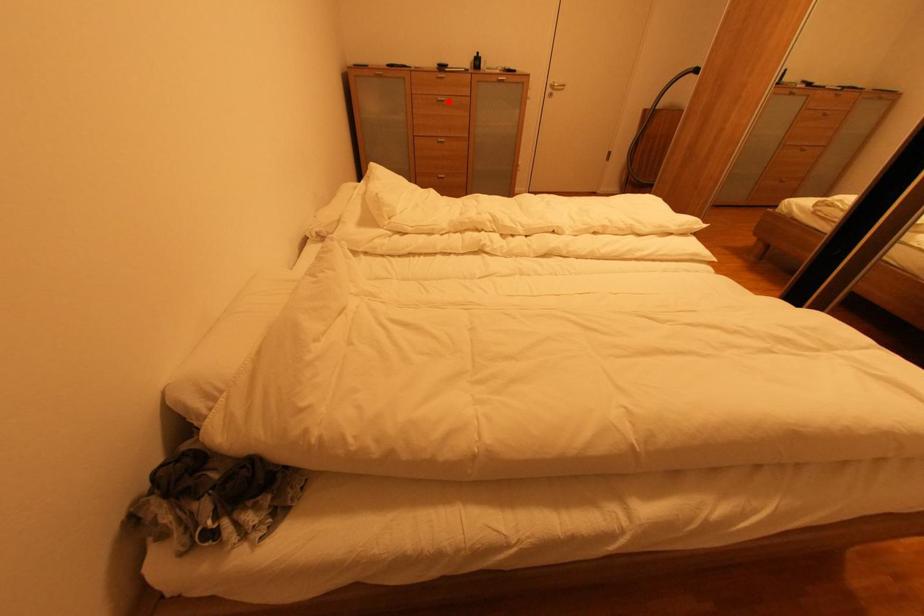
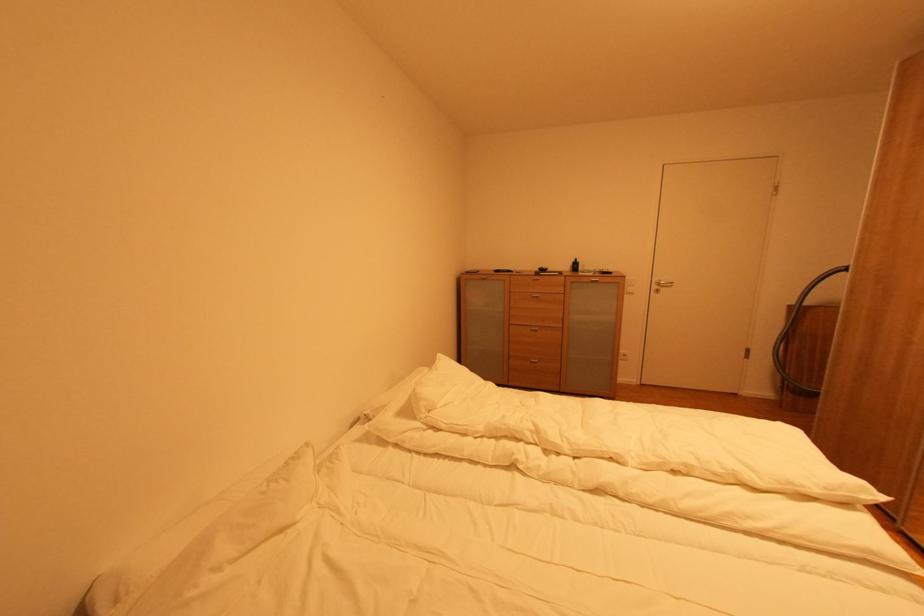
Locate, in the second image, the point that corresponds to the highlighted location in the first image.

(542, 298)